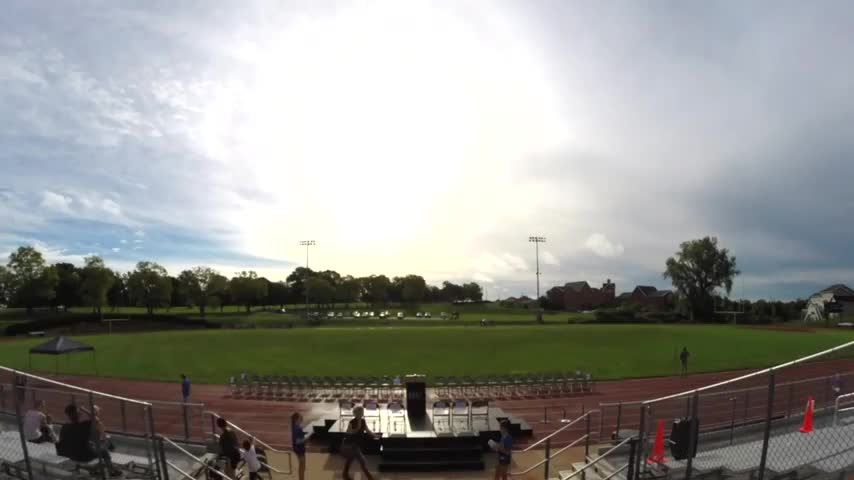
The image size is (854, 480). Identify the location of podium. (412, 401).